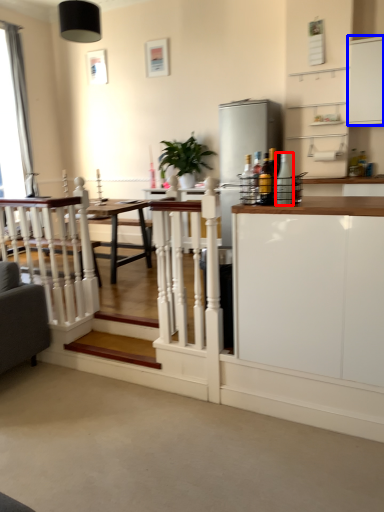
Question: Among these objects, which one is farthest to the camera, bottle (highlighted by a red box) or cabinetry (highlighted by a blue box)?

Choices:
 (A) bottle
 (B) cabinetry

Answer: (B)